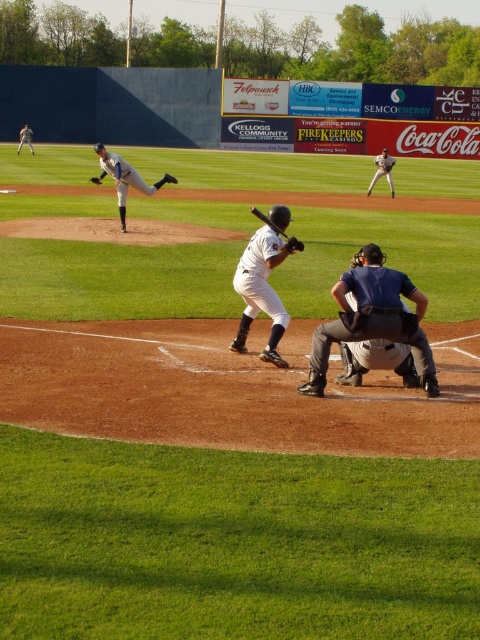
Between point (419, 355) and point (91, 180), which one is positioned behind?

The point (91, 180) is more distant.

Is point (396, 316) in front of point (93, 177)?

Yes.

You are a GUI agent. You are given a task and a screenshot of the screen. Output one action in this format:
    pyautogui.click(x=<x>, y=<y>)
    Task: Click on the gray fabric umpire at center
    The height and width of the screenshot is (640, 480).
    Given the screenshot: What is the action you would take?
    pyautogui.click(x=372, y=317)

Does white uniformed pitcher at upper left have a lesser height compared to black leather glove at center?

No, white uniformed pitcher at upper left is not shorter than black leather glove at center.

Who is more forward, (104, 163) or (164, 180)?

Point (104, 163) is more forward.

The height and width of the screenshot is (640, 480). In order to click on white uniformed pitcher at upper left in this screenshot , I will do `click(121, 179)`.

Is wooden baseball bat at center taller than brown leather glove at lower center?

Yes.

Consider the image. Who is more distant from viewer, (268, 220) or (302, 244)?

The point (302, 244) is behind.

The height and width of the screenshot is (640, 480). What do you see at coordinates (267, 221) in the screenshot?
I see `wooden baseball bat at center` at bounding box center [267, 221].

Identify the location of wooden baseball bat at center. (267, 221).